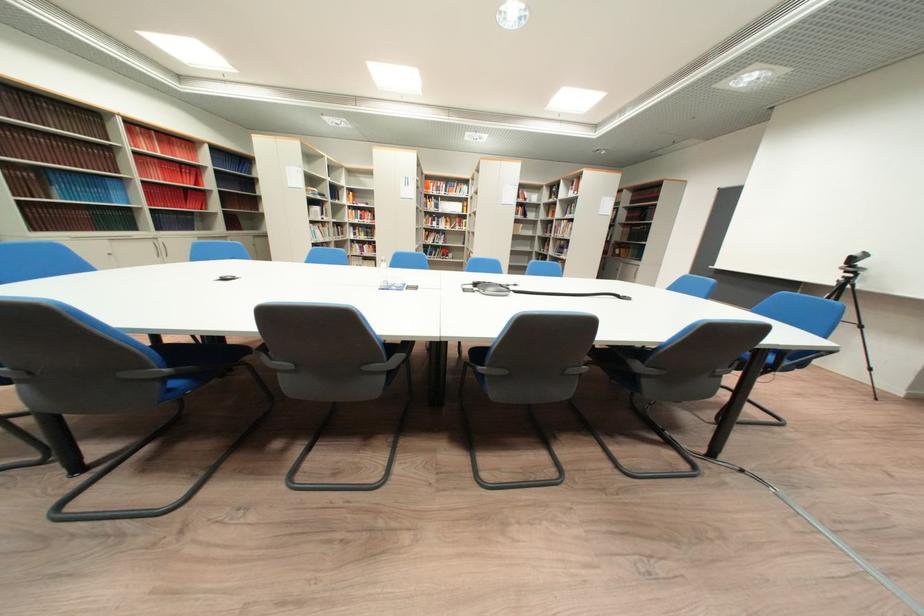
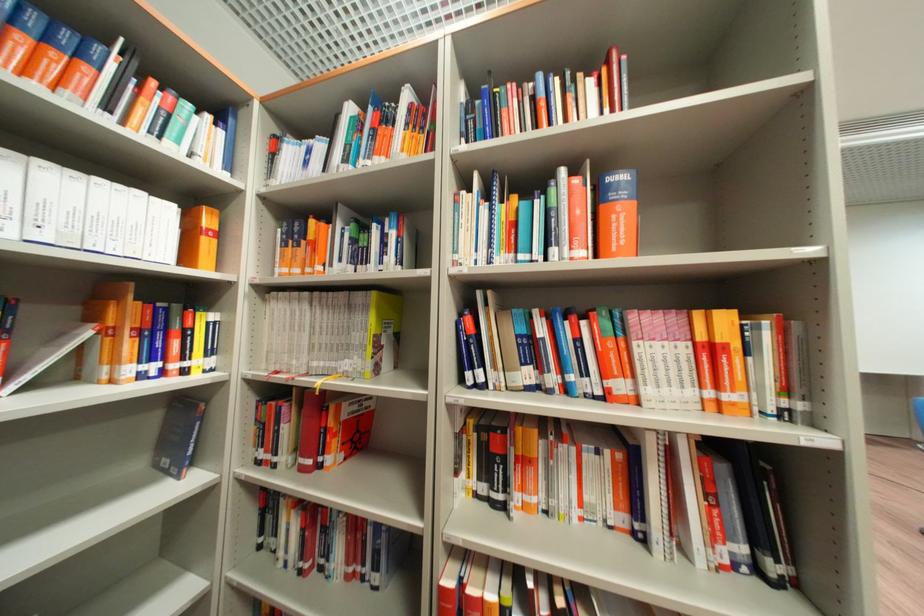
Find the pixel in the second image that matches (x=473, y=213) in the first image.

(198, 260)